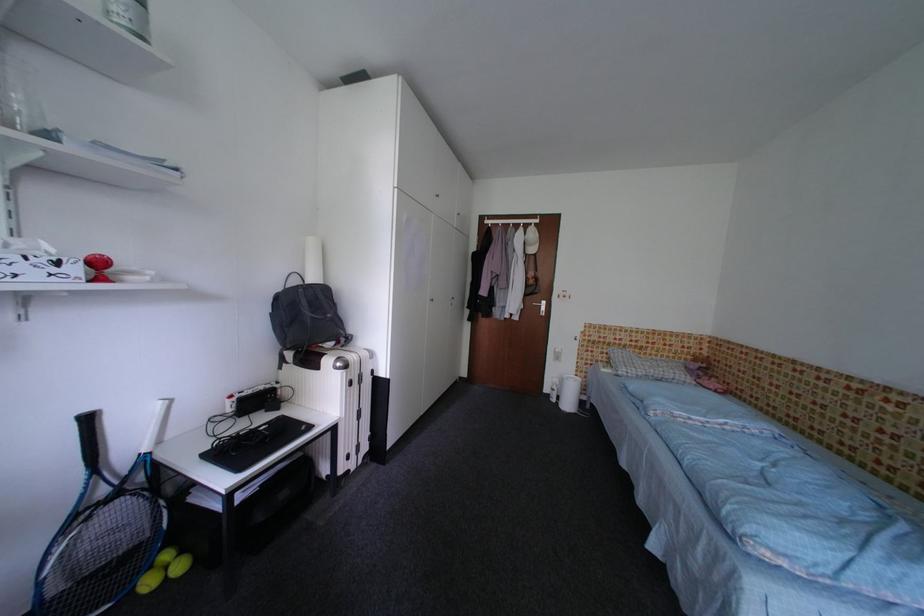
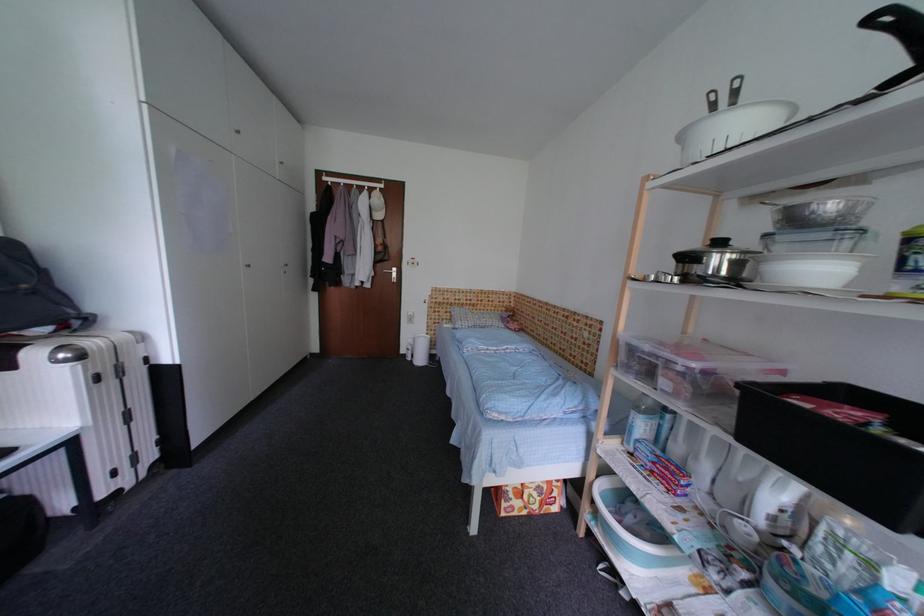
In a continuous first-person perspective shot, in which direction is the camera moving?

The cameraman moved toward right, backward.